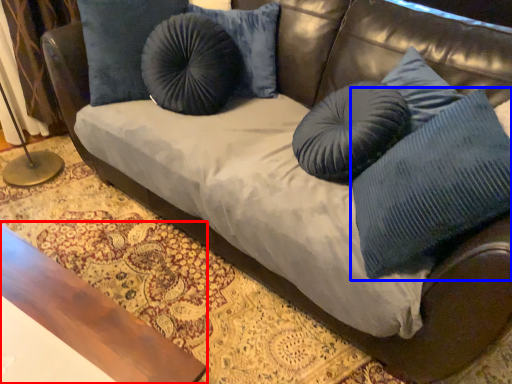
Question: Which point is further to the camera, table (highlighted by a red box) or pillow (highlighted by a blue box)?

Choices:
 (A) table
 (B) pillow

Answer: (B)